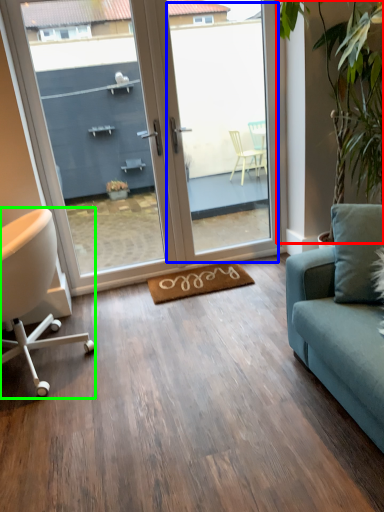
Question: Considering the real-world distances, which object is closest to plant (highlighted by a red box)? window screen (highlighted by a blue box) or chair (highlighted by a green box).

Choices:
 (A) window screen
 (B) chair

Answer: (A)